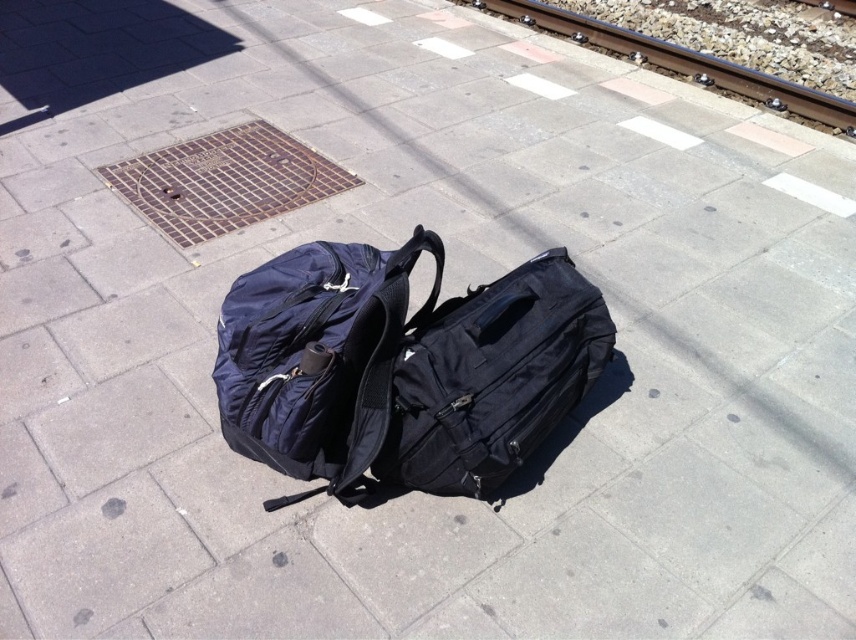
Question: Which point is closer to the camera taking this photo?

Choices:
 (A) (361, 381)
 (B) (516, 19)
 (C) (566, 256)

Answer: (A)

Question: Can you confirm if navy blue fabric backpack at center is positioned to the left of metal at upper right?

Choices:
 (A) no
 (B) yes

Answer: (B)

Question: Which point is closer to the camera?

Choices:
 (A) (545, 308)
 (B) (789, 104)
 (C) (379, 444)

Answer: (C)

Question: Does navy blue fabric backpack at center appear over metal at upper right?

Choices:
 (A) no
 (B) yes

Answer: (A)

Question: Considering the real-world distances, which object is closest to the navy blue fabric backpack at center?

Choices:
 (A) black fabric backpack at center
 (B) metal at upper right

Answer: (A)

Question: Is navy blue fabric backpack at center to the right of metal at upper right from the viewer's perspective?

Choices:
 (A) yes
 (B) no

Answer: (B)